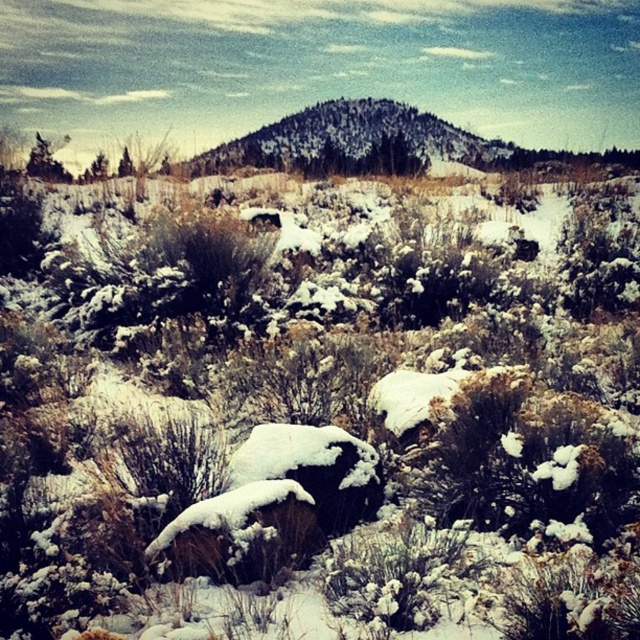
Is point (385, 138) farther from camera compared to point (273, 474)?

That is True.

Describe the element at coordinates (349, 140) in the screenshot. This screenshot has height=640, width=640. I see `green textured hill at center` at that location.

Where is `green textured hill at center`? The image size is (640, 640). green textured hill at center is located at coordinates (349, 140).

Can you confirm if snow-covered rock at center is positioned to the left of green textured bush at upper left?

No, snow-covered rock at center is not to the left of green textured bush at upper left.

Does snow-covered rock at center appear under green textured bush at upper left?

Indeed, snow-covered rock at center is positioned under green textured bush at upper left.

Between point (381, 493) and point (61, 170), which one is positioned behind?

Positioned behind is point (61, 170).

This screenshot has height=640, width=640. Identify the location of snow-covered rock at center. (314, 468).

Is green textured hill at center taller than green textured bush at upper left?

Yes.

Can you confirm if green textured hill at center is positioned below green textured bush at upper left?

No.

Find the location of a particular element. Image resolution: width=640 pixels, height=640 pixels. green textured hill at center is located at coordinates (349, 140).